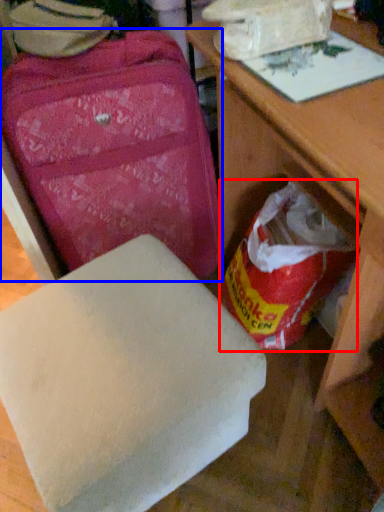
Question: Which of the following is the closest to the observer, grocery bag (highlighted by a red box) or suitcase (highlighted by a blue box)?

Choices:
 (A) grocery bag
 (B) suitcase

Answer: (B)